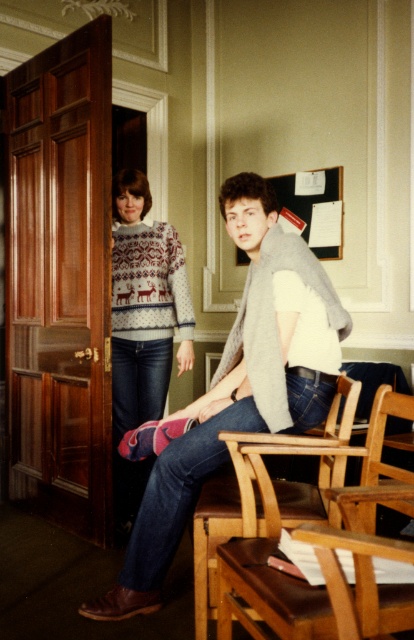
Question: Can you confirm if white knit sweater at center is positioned to the right of brown leather chair at lower center?

Choices:
 (A) yes
 (B) no

Answer: (B)

Question: Is white knit sweater at center to the right of brown leather chair at lower center from the viewer's perspective?

Choices:
 (A) no
 (B) yes

Answer: (A)

Question: Which object is positioned closest to the white knit sweater with reindeer pattern at left?

Choices:
 (A) brown leather chair at lower center
 (B) white knit sweater at center

Answer: (B)

Question: Which of the following is the farthest from the observer?

Choices:
 (A) white knit sweater with reindeer pattern at left
 (B) white knit sweater at center

Answer: (A)

Question: Which point is closer to the camera taking this photo?

Choices:
 (A) (211, 588)
 (B) (327, 388)

Answer: (A)

Question: Is white knit sweater at center above white knit sweater with reindeer pattern at left?

Choices:
 (A) no
 (B) yes

Answer: (A)